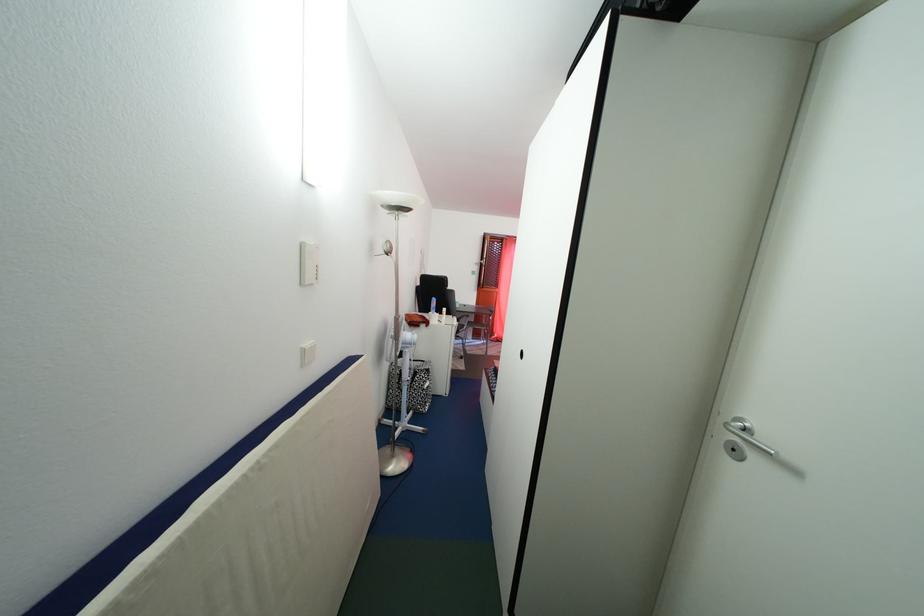
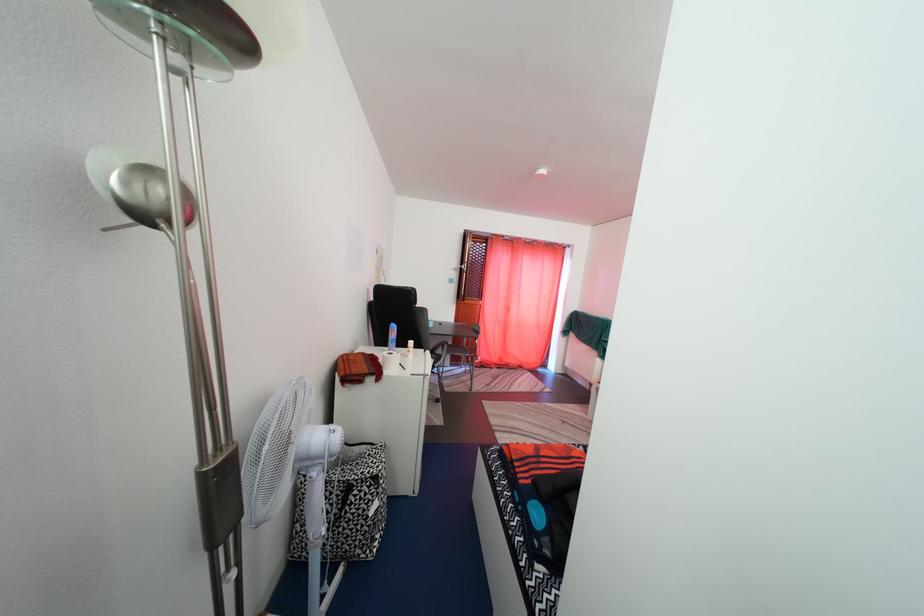
Question: The images are taken continuously from a first-person perspective. In which direction are you moving?

Choices:
 (A) Left
 (B) Right
 (C) Forward
 (D) Backward

Answer: (C)